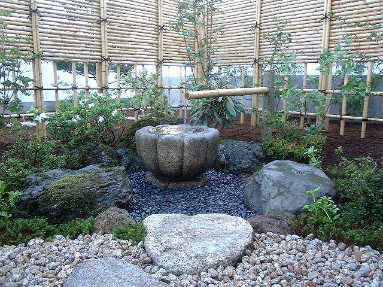
Image resolution: width=383 pixels, height=287 pixels. I want to click on fenestration, so click(175, 73), click(45, 71), click(359, 103), click(373, 108).